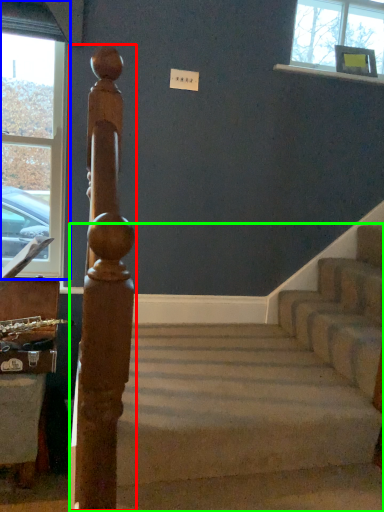
Question: Which object is the farthest from beam (highlighted by a red box)? Choose among these: window (highlighted by a blue box) or stairs (highlighted by a green box).

Choices:
 (A) window
 (B) stairs

Answer: (A)